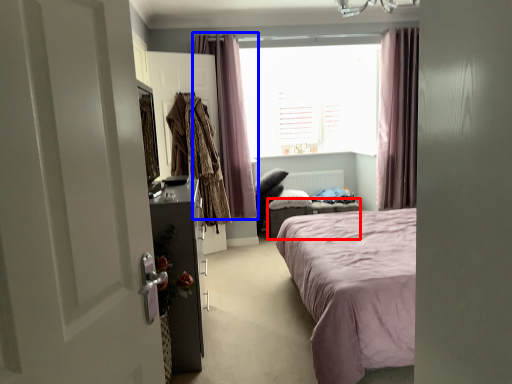
Question: Which point is closer to the camera, furniture (highlighted by a red box) or curtain (highlighted by a blue box)?

Choices:
 (A) furniture
 (B) curtain

Answer: (B)